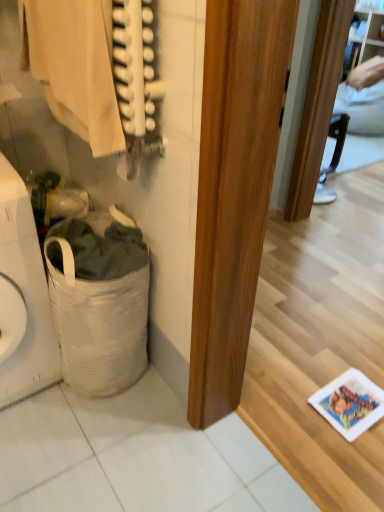
Question: Does light beige fabric at upper left have a smaller size compared to white fabric laundry basket at lower left?

Choices:
 (A) yes
 (B) no

Answer: (A)

Question: Does light beige fabric at upper left have a lesser height compared to white fabric laundry basket at lower left?

Choices:
 (A) no
 (B) yes

Answer: (B)

Question: Is white fabric laundry basket at lower left completely or partially inside light beige fabric at upper left?

Choices:
 (A) no
 (B) yes

Answer: (A)

Question: Is light beige fabric at upper left outside white fabric laundry basket at lower left?

Choices:
 (A) no
 (B) yes

Answer: (B)

Question: Is white fabric laundry basket at lower left at the back of light beige fabric at upper left?

Choices:
 (A) yes
 (B) no

Answer: (B)

Question: Is light beige fabric at upper left next to white fabric laundry basket at lower left and touching it?

Choices:
 (A) no
 (B) yes

Answer: (A)

Question: Is white fabric laundry basket at lower left at the left side of light beige fabric at upper left?

Choices:
 (A) yes
 (B) no

Answer: (B)

Question: Is white fabric laundry basket at lower left smaller than light beige fabric at upper left?

Choices:
 (A) no
 (B) yes

Answer: (A)

Question: From a real-world perspective, is white fabric laundry basket at lower left below light beige fabric at upper left?

Choices:
 (A) no
 (B) yes

Answer: (B)

Question: Is white fabric laundry basket at lower left completely or partially outside of light beige fabric at upper left?

Choices:
 (A) yes
 (B) no

Answer: (A)

Question: Can you see white fabric laundry basket at lower left touching light beige fabric at upper left?

Choices:
 (A) no
 (B) yes

Answer: (A)

Question: Is white fabric laundry basket at lower left further to the viewer compared to light beige fabric at upper left?

Choices:
 (A) yes
 (B) no

Answer: (A)

Question: Is white woven laundry basket at lower left looking in the opposite direction of light beige fabric at upper left?

Choices:
 (A) yes
 (B) no

Answer: (B)